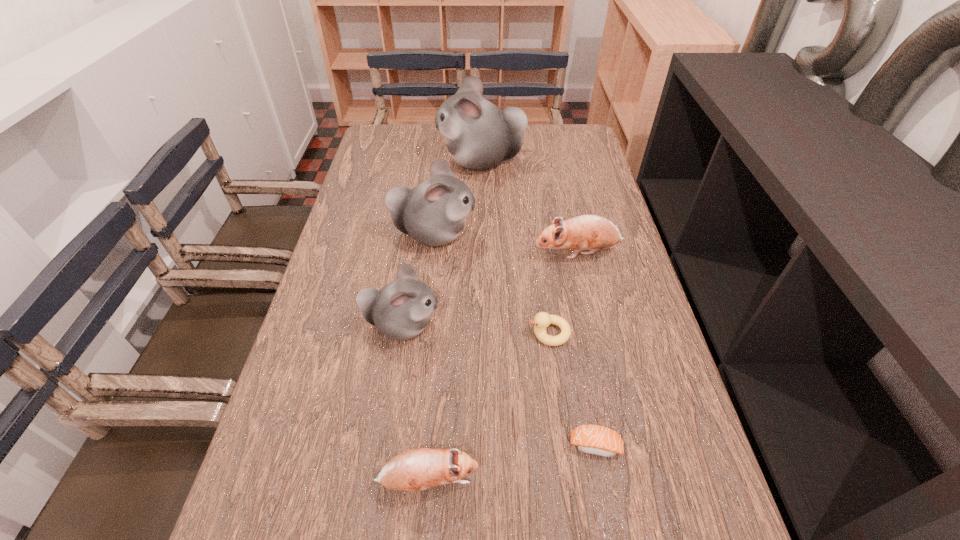
You are a GUI agent. You are given a task and a screenshot of the screen. Output one action in this format:
    pyautogui.click(x=<x>, y=<y>)
    Task: Click on the duckling
    This screenshot has height=540, width=960.
    Given the screenshot: What is the action you would take?
    pyautogui.click(x=542, y=320)

In order to click on orange sushi in this screenshot , I will do `click(593, 439)`.

I want to click on the shortest object, so click(593, 439).

I want to click on free space located on the face of the tallest object, so click(x=372, y=161).

What are the coordinates of `free region located on the face of the tallest object` in the screenshot? It's located at (363, 161).

Identify the location of free space located 0.100m on the face of the tallest object. The width and height of the screenshot is (960, 540). (409, 161).

Locate an element on the screen. The image size is (960, 540). free point located on the face of the second farthest white hamster is located at coordinates (609, 235).

Where is `vacant point located 0.280m on the face of the fourth farthest hamster`? vacant point located 0.280m on the face of the fourth farthest hamster is located at coordinates (561, 326).

This screenshot has height=540, width=960. What are the coordinates of `vacant space located at the face of the bigger brown hamster` in the screenshot? It's located at (486, 253).

In order to click on vacant space located 0.110m at the face of the bigger brown hamster in this screenshot , I will do `click(493, 253)`.